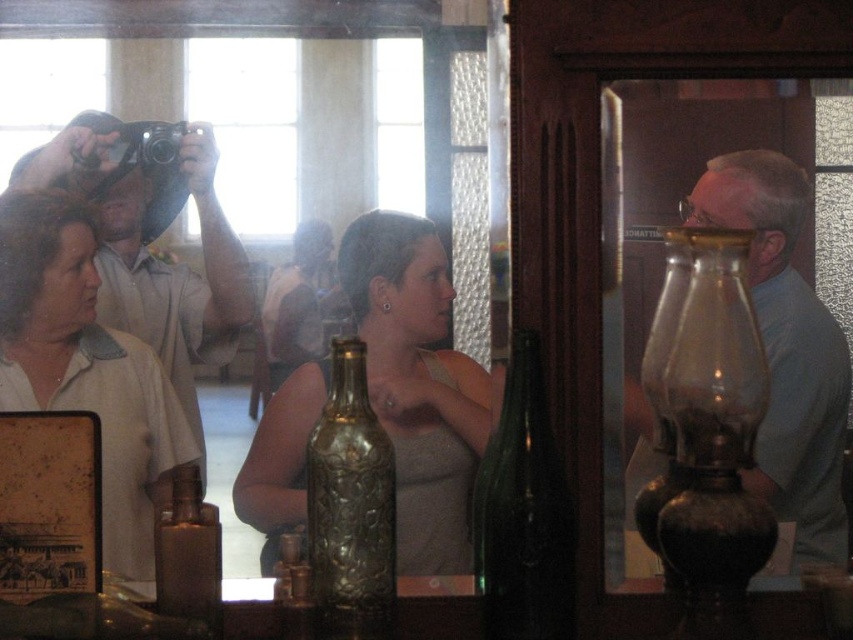
What do you see at coordinates (705, 433) in the screenshot? This screenshot has height=640, width=853. I see `transparent glass lamp at right` at bounding box center [705, 433].

Does transparent glass lamp at right appear over green glass bottle at center?

Indeed, transparent glass lamp at right is positioned over green glass bottle at center.

Image resolution: width=853 pixels, height=640 pixels. Identify the location of transparent glass lamp at right. (705, 433).

Locate an element on the screen. The height and width of the screenshot is (640, 853). transparent glass lamp at right is located at coordinates (705, 433).

Which is above, transparent glass lamp at right or matte blue shirt at right?

matte blue shirt at right

Between point (676, 588) and point (801, 214), which one is positioned behind?

The point (801, 214) is more distant.

Locate an element on the screen. The height and width of the screenshot is (640, 853). transparent glass lamp at right is located at coordinates (705, 433).

Does matte gold bottle at center have a lesser height compared to transparent glass lamp at right?

Yes, matte gold bottle at center is shorter than transparent glass lamp at right.

How distant is matte gold bottle at center from transparent glass lamp at right?

matte gold bottle at center is 13.33 inches from transparent glass lamp at right.

The width and height of the screenshot is (853, 640). What are the coordinates of `matte gold bottle at center` in the screenshot? It's located at (416, 384).

The height and width of the screenshot is (640, 853). What are the coordinates of `matte gold bottle at center` in the screenshot? It's located at (416, 384).